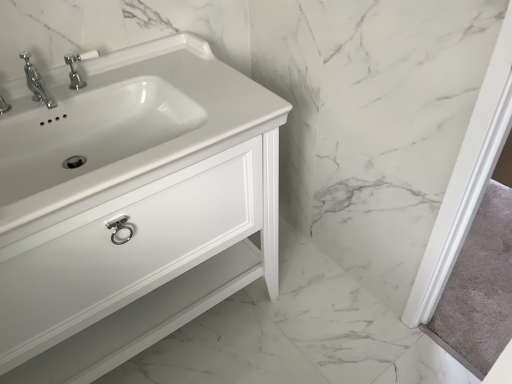
Question: Is white glossy cabinet at left closer to camera compared to white ceramic tap at upper left?

Choices:
 (A) no
 (B) yes

Answer: (B)

Question: Can you confirm if white glossy cabinet at left is positioned to the right of white ceramic tap at upper left?

Choices:
 (A) yes
 (B) no

Answer: (A)

Question: Is white glossy cabinet at left completely or partially outside of white ceramic tap at upper left?

Choices:
 (A) yes
 (B) no

Answer: (A)

Question: Can you confirm if white glossy cabinet at left is bigger than white ceramic tap at upper left?

Choices:
 (A) yes
 (B) no

Answer: (A)

Question: Can you confirm if white glossy cabinet at left is shorter than white ceramic tap at upper left?

Choices:
 (A) yes
 (B) no

Answer: (B)

Question: From a real-world perspective, is white glossy cabinet at left located beneath white ceramic tap at upper left?

Choices:
 (A) no
 (B) yes

Answer: (B)

Question: Considering the relative sizes of white ceramic tap at upper left and white glossy cabinet at left in the image provided, is white ceramic tap at upper left smaller than white glossy cabinet at left?

Choices:
 (A) yes
 (B) no

Answer: (A)

Question: Is white ceramic tap at upper left surrounding white glossy cabinet at left?

Choices:
 (A) no
 (B) yes

Answer: (A)

Question: Considering the relative positions of white ceramic tap at upper left and white glossy cabinet at left in the image provided, is white ceramic tap at upper left to the right of white glossy cabinet at left from the viewer's perspective?

Choices:
 (A) yes
 (B) no

Answer: (B)

Question: Is white ceramic tap at upper left taller than white glossy cabinet at left?

Choices:
 (A) yes
 (B) no

Answer: (B)

Question: From the image's perspective, is white ceramic tap at upper left under white glossy cabinet at left?

Choices:
 (A) no
 (B) yes

Answer: (A)

Question: Is white ceramic tap at upper left to the left of white glossy cabinet at left from the viewer's perspective?

Choices:
 (A) yes
 (B) no

Answer: (A)

Question: Is point (96, 54) positioned closer to the camera than point (28, 97)?

Choices:
 (A) closer
 (B) farther

Answer: (B)